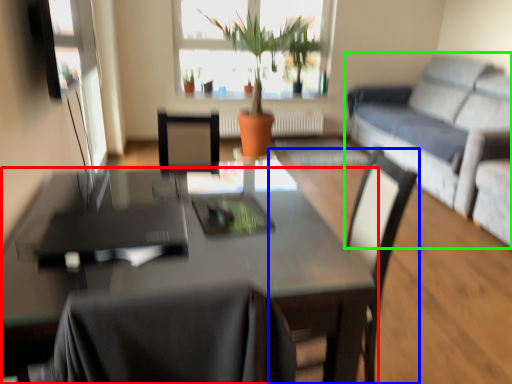
Question: Which object is positioned farthest from table (highlighted by a red box)? Select from chair (highlighted by a blue box) and studio couch (highlighted by a green box).

Choices:
 (A) chair
 (B) studio couch

Answer: (B)